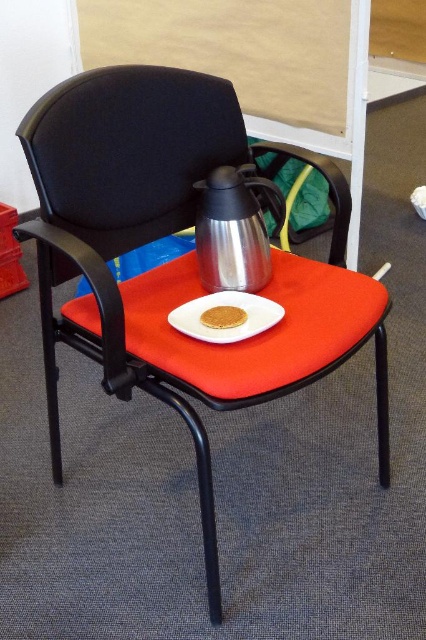
You are standing in an office and see the white matte plate at center on the chair. You want to reach it without moving your feet. Can you do it if your arm can extend 36 inches?

The white matte plate at center is 39.20 inches away from the viewer. Since your arm can only extend 36 inches, you cannot reach it without moving your feet.

You are sitting in the office chair and want to reach both the point at coordinates point (132, 289) and point (279, 305). Which point is closer to you?

The point at coordinates point (132, 289) is closer to you because it is further to the viewer than point (279, 305).

You are a person sitting in the office chair and want to eat the golden crumbly cookie at center. Since the cookie is on the white matte plate at center, can you comfortably hold both the plate and the cookie at the same time?

The white matte plate at center is larger than the golden crumbly cookie at center, so yes, you can comfortably hold both the plate and the cookie at the same time since the plate can easily accommodate the cookie.